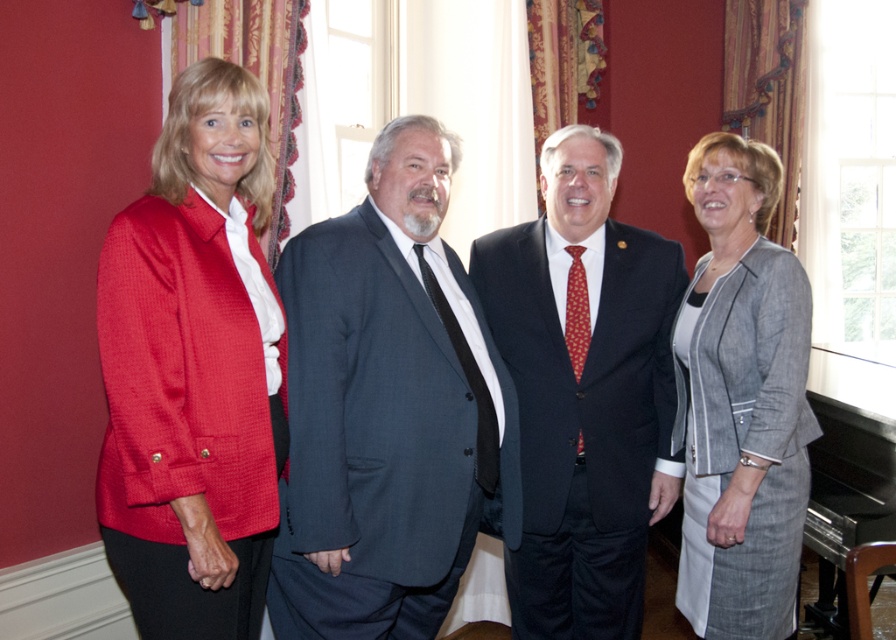
Between dark blue suit at center and gray textured blazer at right, which one has less height?

Result: gray textured blazer at right is shorter.

Is point (638, 269) farther from viewer compared to point (725, 352)?

Yes, point (638, 269) is farther from viewer.

Is point (593, 570) positioned behind point (782, 493)?

That is True.

This screenshot has height=640, width=896. What are the coordinates of `dark blue suit at center` in the screenshot? It's located at (584, 392).

Identify the location of dark gray suit at center. This screenshot has width=896, height=640. (386, 408).

In the scene shown: Between dark gray suit at center and gray textured blazer at right, which one is positioned lower?

Positioned lower is dark gray suit at center.

You are a GUI agent. You are given a task and a screenshot of the screen. Output one action in this format:
    pyautogui.click(x=<x>, y=<y>)
    Task: Click on the dark gray suit at center
    
    Given the screenshot: What is the action you would take?
    pyautogui.click(x=386, y=408)

What are the coordinates of `dark gray suit at center` in the screenshot? It's located at (386, 408).

Can you confirm if matte red blazer at left is taller than dark blue suit at center?

In fact, matte red blazer at left may be shorter than dark blue suit at center.

Which is below, matte red blazer at left or dark blue suit at center?

dark blue suit at center

At what (x,y) coordinates should I click in order to perform the action: click on matte red blazer at left. Please return your answer as a coordinate pair (x, y). The width and height of the screenshot is (896, 640). Looking at the image, I should click on (194, 369).